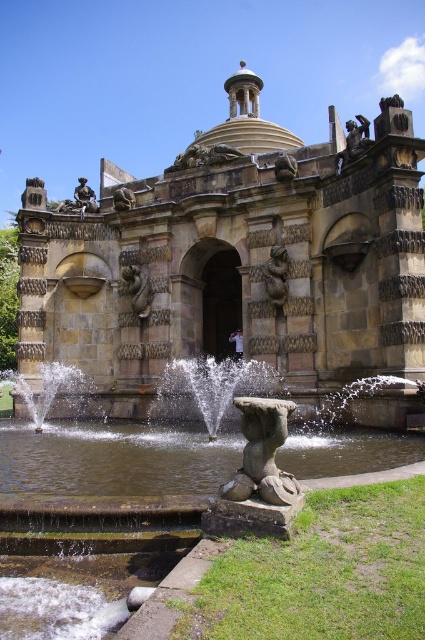
Question: Which object is positioned closest to the stone statue at center?

Choices:
 (A) bronze statue at upper left
 (B) clear water at fountain center
 (C) brown stone statue at center

Answer: (B)

Question: Does clear water at fountain center appear under stone statue at center?

Choices:
 (A) yes
 (B) no

Answer: (A)

Question: Which point is closer to the camera?

Choices:
 (A) (85, 451)
 (B) (396, 257)
 (C) (141, 289)

Answer: (B)

Question: Can you confirm if brown stone lion at center is thinner than sandy stone statue at upper left?

Choices:
 (A) yes
 (B) no

Answer: (A)

Question: Estimate the real-world distances between objects in this image. Which object is farther from the green mossy stone fountain at lower left?

Choices:
 (A) clear water at fountain center
 (B) brown stone statue at center
 (C) bronze statue at upper left
 (D) matte stone lion at upper center

Answer: (C)

Question: Can you confirm if brown stone palace at center is positioned below bronze statue at upper left?

Choices:
 (A) no
 (B) yes

Answer: (A)